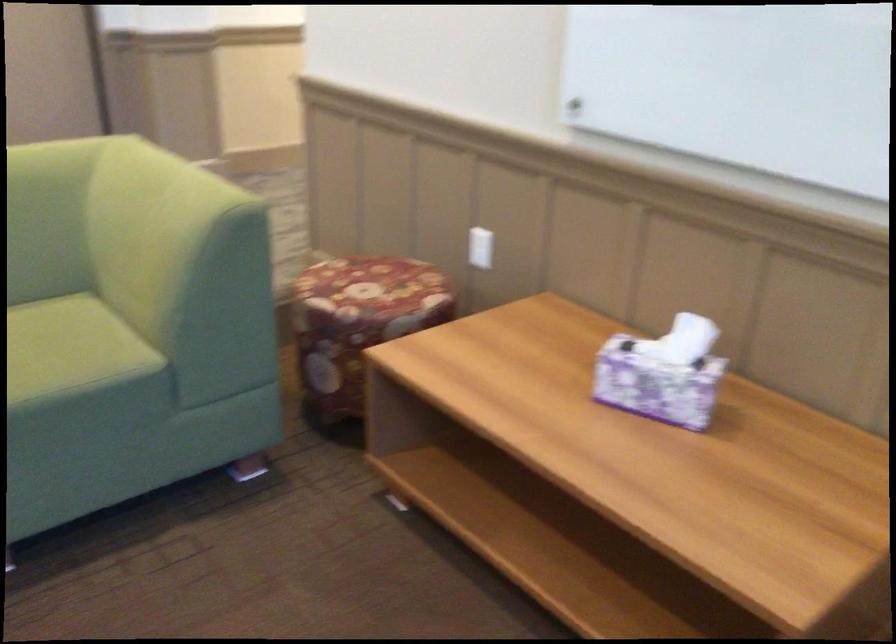
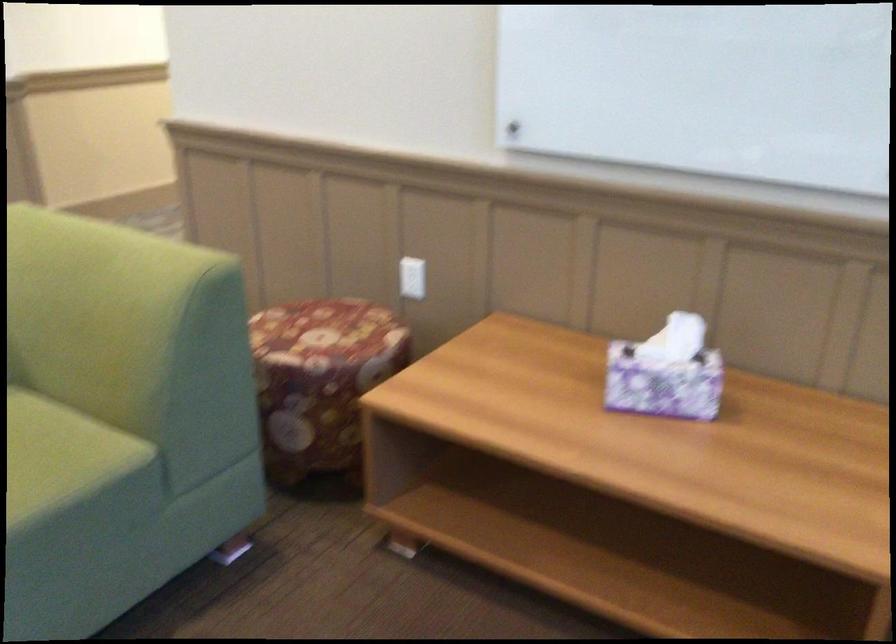
Question: The first image is from the beginning of the video and the second image is from the end. How did the camera likely rotate when shooting the video?

Choices:
 (A) Left
 (B) Right
 (C) Up
 (D) Down

Answer: (B)